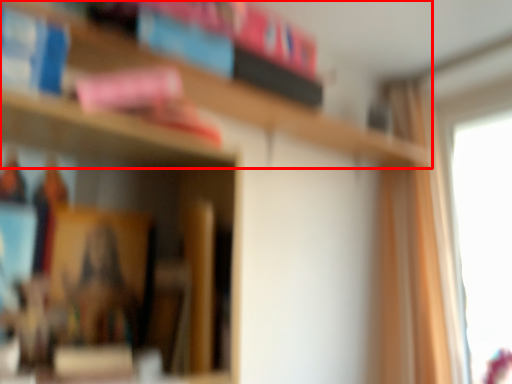
Question: From the image, what is the correct spatial relationship of bookcase (annotated by the red box) in relation to curtain?

Choices:
 (A) left
 (B) right

Answer: (A)